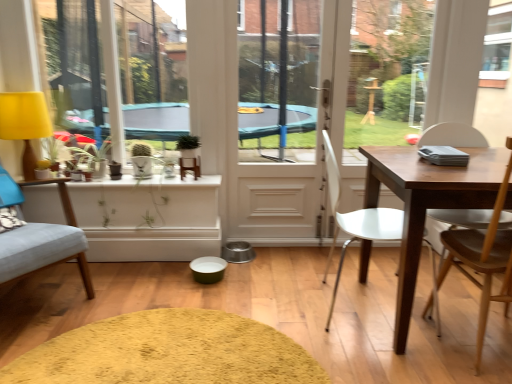
Question: Is soft yellow rug at center inside or outside of yellow fabric lampshade at left?

Choices:
 (A) outside
 (B) inside

Answer: (A)

Question: In the image, is soft yellow rug at center positioned in front of or behind yellow fabric lampshade at left?

Choices:
 (A) behind
 (B) front

Answer: (B)

Question: Which of these objects is positioned farthest from the white glossy screen door at center?

Choices:
 (A) green matte plant at upper center
 (B) soft yellow rug at center
 (C) light blue fabric chair at left, the 1th chair in the left-to-right sequence
 (D) yellow fabric at left
 (E) yellow fabric lampshade at left

Answer: (E)

Question: Which of these objects is positioned farthest from the wooden chair at right, arranged as the 3th chair when viewed from the left?

Choices:
 (A) yellow fabric at left
 (B) white plastic chair at center, the 2th chair when ordered from right to left
 (C) white glossy screen door at center
 (D) green matte plant at upper center
 (E) soft yellow rug at center

Answer: (A)